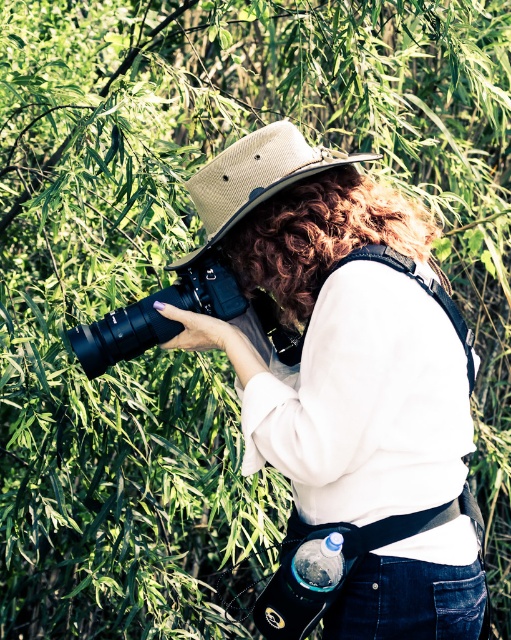
Between beige canvas hat at center and black plastic camera at center, which one appears on the left side from the viewer's perspective?

From the viewer's perspective, black plastic camera at center appears more on the left side.

Does point (240, 173) come closer to viewer compared to point (241, 291)?

Yes, it is.

The height and width of the screenshot is (640, 511). In order to click on beige canvas hat at center in this screenshot , I will do `click(253, 177)`.